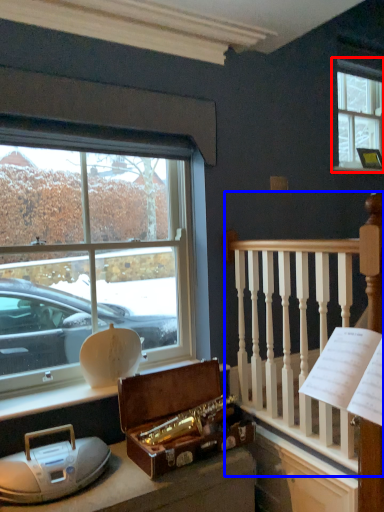
Question: Which point is closer to the camera, window (highlighted by a red box) or rail (highlighted by a blue box)?

Choices:
 (A) window
 (B) rail

Answer: (B)